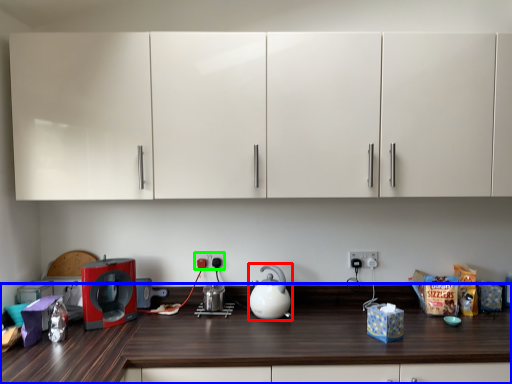
Question: Which object is the closest to the kitchen appliance (highlighted by a red box)? Choose among these: countertop (highlighted by a blue box) or electric outlet (highlighted by a green box).

Choices:
 (A) countertop
 (B) electric outlet

Answer: (B)